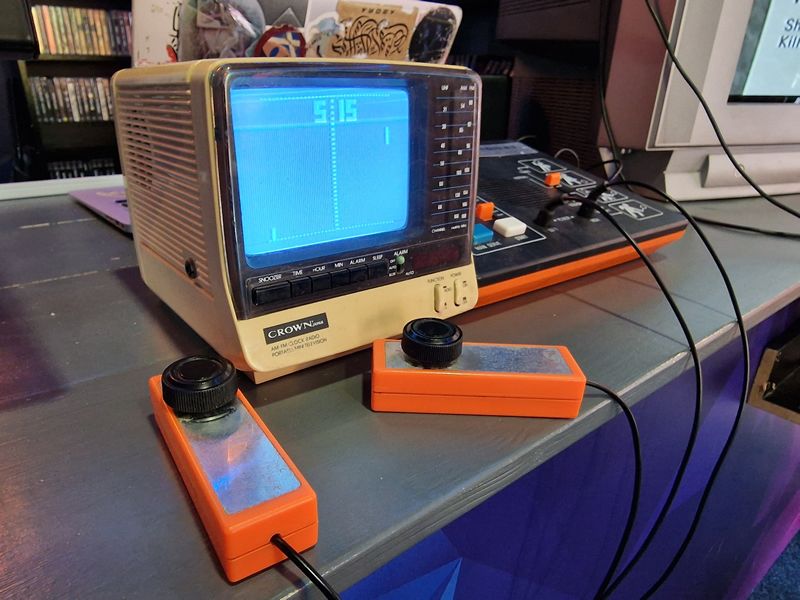
Identify the location of shelf. This screenshot has height=600, width=800. (81, 57).